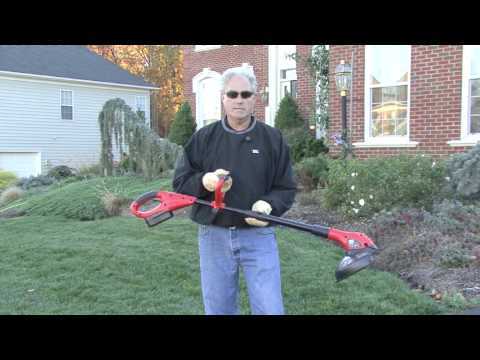
Identify the location of windows. (389, 103), (467, 117).